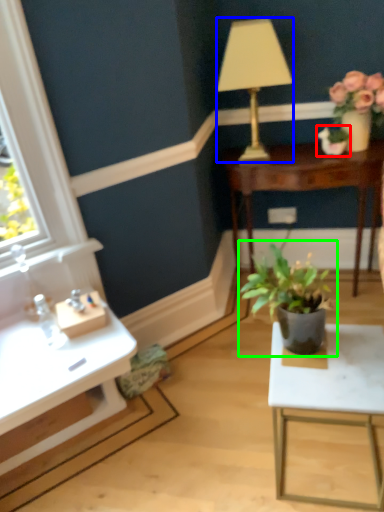
Question: Which object is the farthest from houseplant (highlighted by a red box)? Choose among these: lamp (highlighted by a blue box) or houseplant (highlighted by a green box).

Choices:
 (A) lamp
 (B) houseplant

Answer: (B)